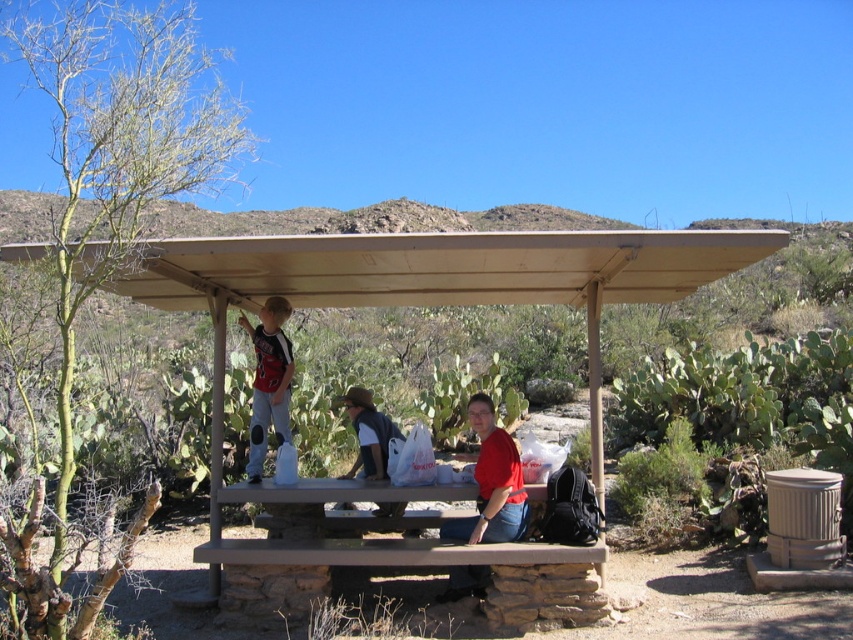
Question: Which point is closer to the camera?

Choices:
 (A) red matte shirt at lower center
 (B) matte red shirt at upper left

Answer: (A)

Question: Estimate the real-world distances between objects in this image. Which object is closer to the red matte shirt at lower center?

Choices:
 (A) denim jacket at lower center
 (B) brown wood bus stop at center

Answer: (A)

Question: Is matte red shirt at upper left to the left of denim jacket at lower center from the viewer's perspective?

Choices:
 (A) no
 (B) yes

Answer: (B)

Question: Does matte red shirt at upper left have a greater width compared to denim jacket at lower center?

Choices:
 (A) yes
 (B) no

Answer: (A)

Question: Can you confirm if brown wood bus stop at center is thinner than matte red shirt at upper left?

Choices:
 (A) no
 (B) yes

Answer: (A)

Question: Among these objects, which one is nearest to the camera?

Choices:
 (A) matte red shirt at upper left
 (B) denim jacket at lower center

Answer: (B)